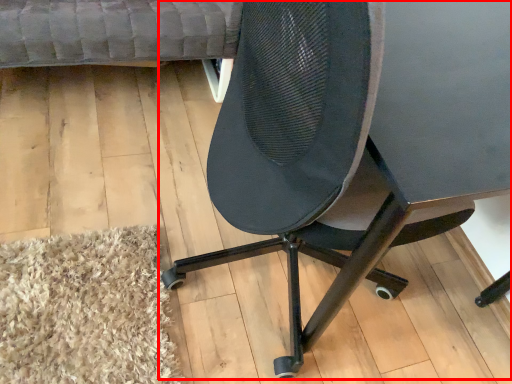
Question: Observing the image, what is the correct spatial positioning of chair (annotated by the red box) in reference to couch?

Choices:
 (A) left
 (B) right

Answer: (B)